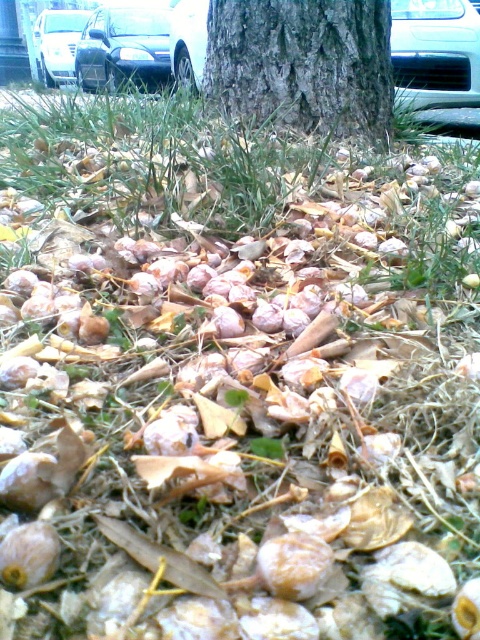
Does brown rough tree trunk at center have a greater height compared to metallic silver car at upper right?

No, brown rough tree trunk at center is not taller than metallic silver car at upper right.

Between brown rough tree trunk at center and metallic silver car at upper right, which one is positioned lower?

brown rough tree trunk at center is below.

In the scene shown: Who is more forward, (352, 104) or (443, 1)?

Point (352, 104)

In order to click on brown rough tree trunk at center in this screenshot , I will do coord(302,65).

Can you confirm if metallic silver car at upper right is thinner than metallic silver car at upper left?

Indeed, metallic silver car at upper right has a lesser width compared to metallic silver car at upper left.

Identify the location of metallic silver car at upper right. This screenshot has height=640, width=480. (434, 52).

At what (x,y) coordinates should I click in order to perform the action: click on metallic silver car at upper right. Please return your answer as a coordinate pair (x, y). The height and width of the screenshot is (640, 480). Looking at the image, I should click on (434, 52).

Between metallic silver car at upper left and silver metallic car at upper left, which one appears on the left side from the viewer's perspective?

silver metallic car at upper left

Describe the element at coordinates (123, 49) in the screenshot. This screenshot has height=640, width=480. I see `metallic silver car at upper left` at that location.

You are a GUI agent. You are given a task and a screenshot of the screen. Output one action in this format:
    pyautogui.click(x=<x>, y=<y>)
    Task: Click on the metallic silver car at upper left
    
    Given the screenshot: What is the action you would take?
    pyautogui.click(x=123, y=49)